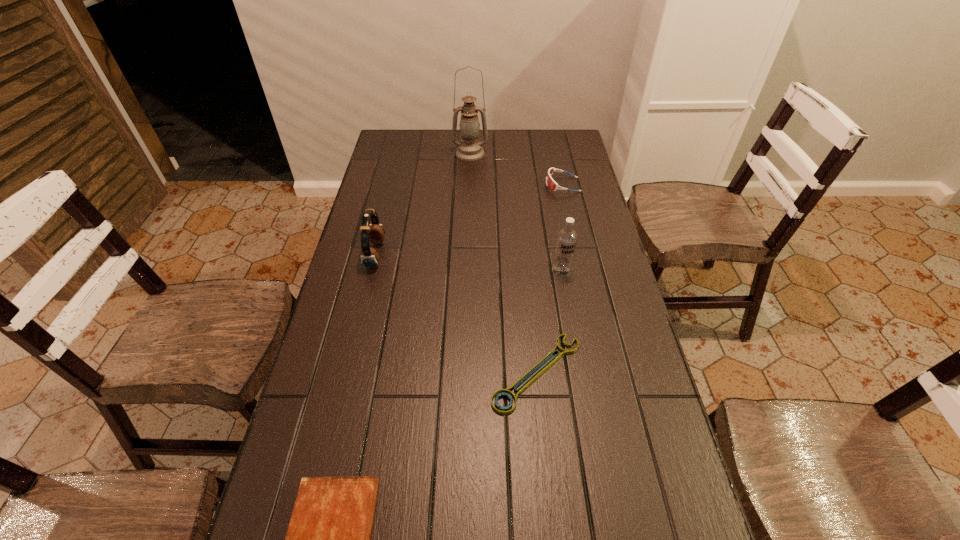
Locate an element on the screen. This screenshot has height=540, width=960. oil lamp is located at coordinates (469, 149).

Image resolution: width=960 pixels, height=540 pixels. What are the coordinates of `the tallest object` in the screenshot? It's located at (469, 149).

The image size is (960, 540). I want to click on vodka, so click(566, 240).

Image resolution: width=960 pixels, height=540 pixels. I want to click on headset, so click(374, 232).

The height and width of the screenshot is (540, 960). In order to click on the second farthest object in this screenshot , I will do `click(551, 184)`.

Image resolution: width=960 pixels, height=540 pixels. I want to click on the third shortest object, so click(551, 184).

Identify the location of the second nearest object. Image resolution: width=960 pixels, height=540 pixels. (507, 393).

Where is `the shortest object`? The width and height of the screenshot is (960, 540). the shortest object is located at coordinates (507, 393).

I want to click on vacant space situated on the right of the tallest object, so click(x=541, y=153).

Locate an element on the screen. vacant region located on the front label of the fifth shortest object is located at coordinates (571, 329).